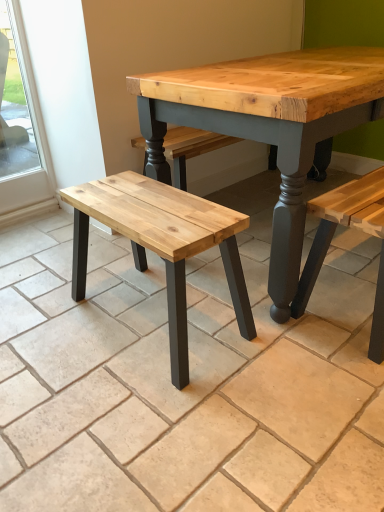
Locate an element on the screen. free space above natural wood bench at left (from a real-world perspective) is located at coordinates (146, 200).